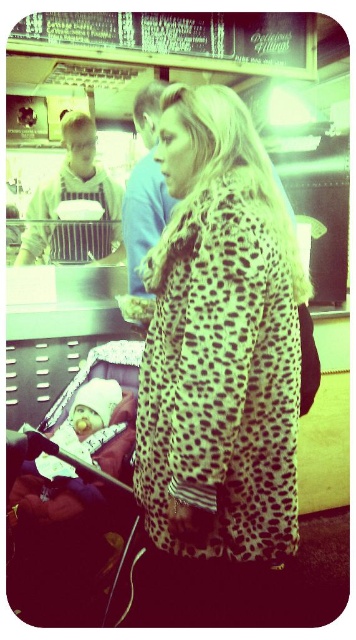
Question: Which point is closer to the camera?

Choices:
 (A) leopard print coat at center
 (B) soft pink fabric baby at center

Answer: (A)

Question: Observing the image, what is the correct spatial positioning of leopard print coat at center in reference to soft pink fabric baby at center?

Choices:
 (A) right
 (B) left

Answer: (A)

Question: Which object is the farthest from the metallic silver baby carriage at lower left?

Choices:
 (A) leopard print coat at center
 (B) soft pink fabric baby at center

Answer: (A)

Question: Which point is farther to the camera?

Choices:
 (A) metallic silver baby carriage at lower left
 (B) soft pink fabric baby at center

Answer: (B)

Question: Is metallic silver baby carriage at lower left thinner than soft pink fabric baby at center?

Choices:
 (A) no
 (B) yes

Answer: (A)

Question: Does leopard print coat at center appear on the left side of soft pink fabric baby at center?

Choices:
 (A) no
 (B) yes

Answer: (A)